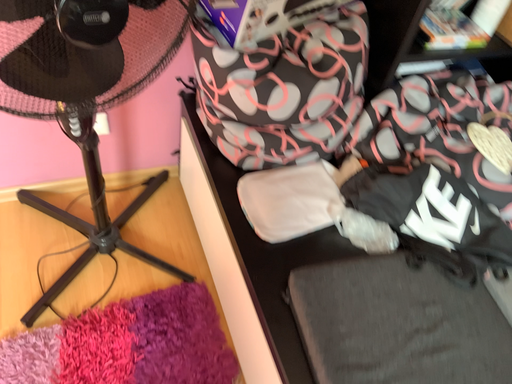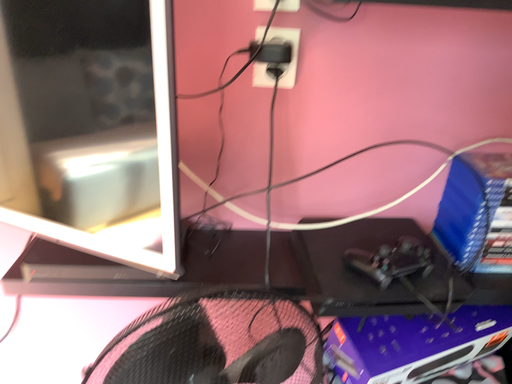
Question: How did the camera likely rotate when shooting the video?

Choices:
 (A) rotated right
 (B) rotated left

Answer: (B)